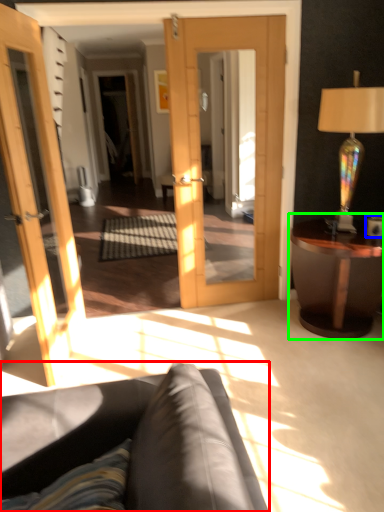
Question: Estimate the real-world distances between objects in this image. Which object is closer to studio couch (highlighted by a red box), coffee cup (highlighted by a blue box) or table (highlighted by a green box)?

Choices:
 (A) coffee cup
 (B) table

Answer: (B)